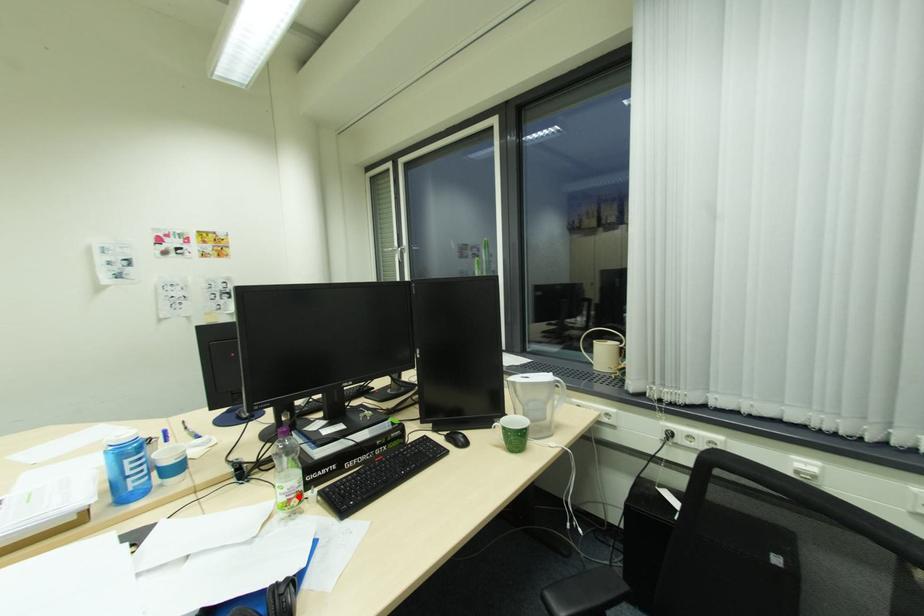
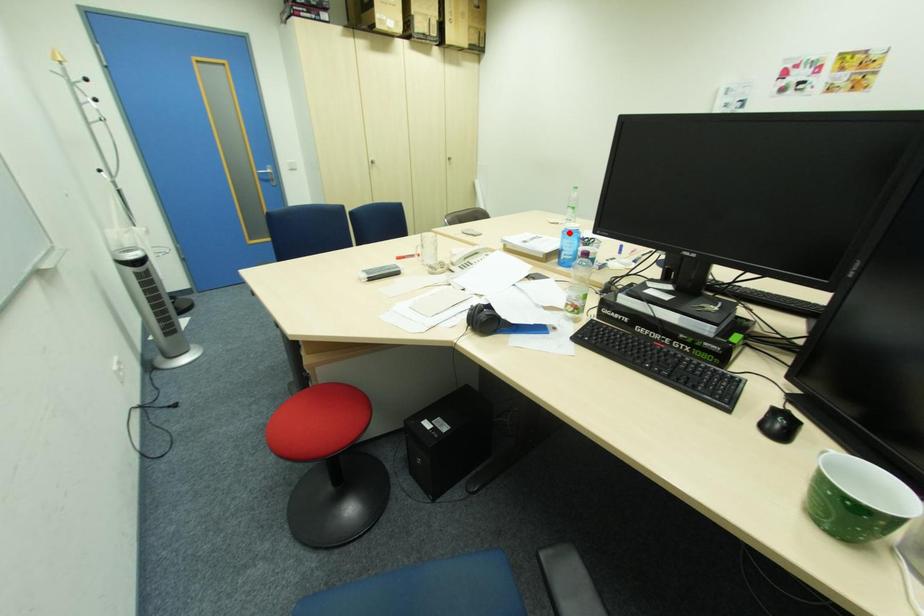
I am providing you with two images of the same scene from different viewpoints. A red point is marked on the first image and another point is marked on the second image. Is the marked point in image1 the same physical position as the marked point in image2?

No